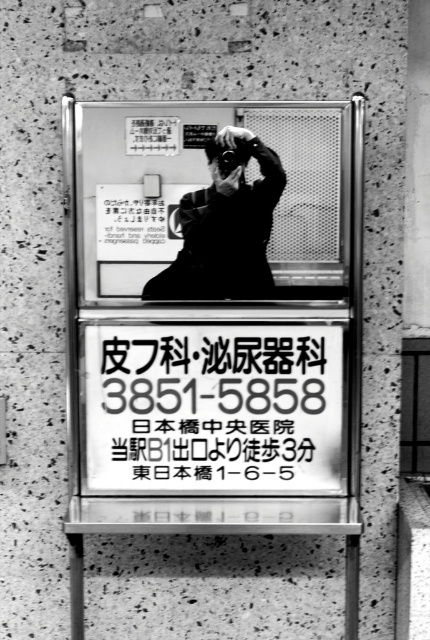
Is black paper sign at center bigger than matte black camera at center?

Indeed, black paper sign at center has a larger size compared to matte black camera at center.

Does black paper sign at center have a lesser height compared to matte black camera at center?

Yes, black paper sign at center is shorter than matte black camera at center.

What do you see at coordinates (209, 406) in the screenshot? I see `black paper sign at center` at bounding box center [209, 406].

This screenshot has width=430, height=640. What are the coordinates of `black paper sign at center` in the screenshot? It's located at pyautogui.click(x=209, y=406).